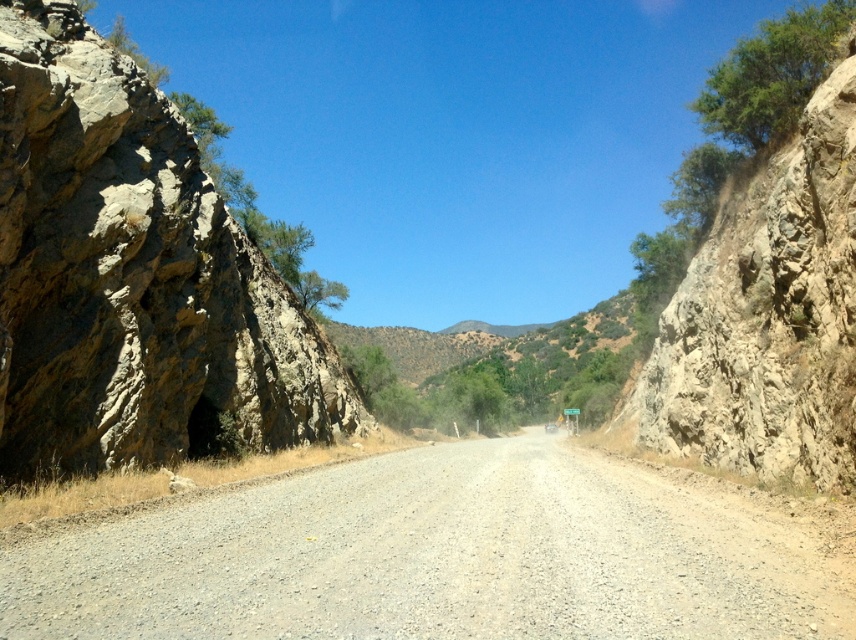
You are a hiker carrying a heavy backpack and need to cross the gray gravel road at center and the rugged stone cliff at right. Which path would allow you to walk more comfortably?

The gray gravel road at center is wider than the rugged stone cliff at right, so it would be more comfortable to walk on the gray gravel road at center because it provides a broader and more stable surface for carrying a heavy backpack.

You are a hiker standing on the gray gravel road at center. You want to climb up to the rugged stone cliff at right. Is the cliff above or below you?

The gray gravel road at center is below the rugged stone cliff at right, so the cliff is above you.

In the scene shown: You are a hiker trying to cross the mountain road. You see the rusty rock formation at left and the rugged stone cliff at right. Which one is narrower?

The rusty rock formation at left is thinner than rugged stone cliff at right, so the rusty rock formation at left is narrower.